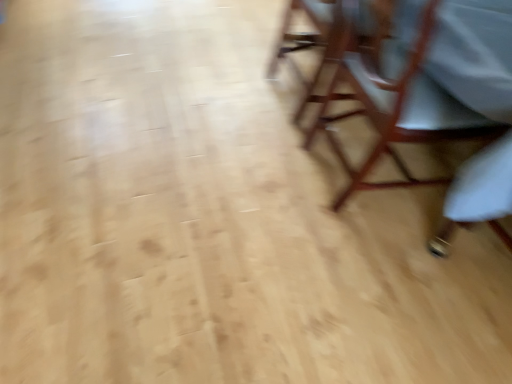
At what (x,y) coordinates should I click in order to perform the action: click on wooden chair at upper right, which is the second chair from front to back. Please return your answer as a coordinate pair (x, y). This screenshot has height=384, width=512. Looking at the image, I should click on (311, 42).

Measure the distance between point (335, 26) and camera.

The distance of point (335, 26) from camera is 6.18 feet.

What is the approximate height of wooden chair at upper right, the 1th chair positioned from the back?

24.34 inches.

The height and width of the screenshot is (384, 512). Describe the element at coordinates (311, 42) in the screenshot. I see `wooden chair at upper right, the 1th chair positioned from the back` at that location.

What do you see at coordinates (393, 100) in the screenshot? I see `wooden chair at right, the 2th chair positioned from the back` at bounding box center [393, 100].

Where is `wooden chair at right, arranged as the 1th chair when viewed from the front`? wooden chair at right, arranged as the 1th chair when viewed from the front is located at coordinates (393, 100).

Identify the location of wooden chair at upper right, which is the second chair from front to back. The width and height of the screenshot is (512, 384). (311, 42).

Which object is positioned more to the right, wooden chair at upper right, the 1th chair positioned from the back, or wooden chair at right, arranged as the 1th chair when viewed from the front?

wooden chair at right, arranged as the 1th chair when viewed from the front, is more to the right.

In the image, is wooden chair at upper right, the 1th chair positioned from the back, positioned in front of or behind wooden chair at right, arranged as the 1th chair when viewed from the front?

Clearly, wooden chair at upper right, the 1th chair positioned from the back, is behind wooden chair at right, arranged as the 1th chair when viewed from the front.

Which is closer to the camera, [365,41] or [378,83]?

Point [365,41] is farther from the camera than point [378,83].

From the image's perspective, between wooden chair at upper right, the 1th chair positioned from the back, and wooden chair at right, the 2th chair positioned from the back, who is located below?

wooden chair at right, the 2th chair positioned from the back, appears lower in the image.

From a real-world perspective, which object stands above the other?

wooden chair at right, the 2th chair positioned from the back.

In the scene shown: Can you confirm if wooden chair at upper right, the 1th chair positioned from the back, is thinner than wooden chair at right, the 2th chair positioned from the back?

Yes.

Does wooden chair at upper right, the 1th chair positioned from the back, have a greater height compared to wooden chair at right, the 2th chair positioned from the back?

→ No, wooden chair at upper right, the 1th chair positioned from the back, is not taller than wooden chair at right, the 2th chair positioned from the back.

Between wooden chair at upper right, the 1th chair positioned from the back, and wooden chair at right, the 2th chair positioned from the back, which one has smaller size?

Smaller between the two is wooden chair at upper right, the 1th chair positioned from the back.

Is wooden chair at upper right, the 1th chair positioned from the back, located outside wooden chair at right, the 2th chair positioned from the back?

Yes, wooden chair at upper right, the 1th chair positioned from the back, is not within wooden chair at right, the 2th chair positioned from the back.

Could you tell me if wooden chair at upper right, the 1th chair positioned from the back, is turned towards wooden chair at right, arranged as the 1th chair when viewed from the front?

No, wooden chair at upper right, the 1th chair positioned from the back, is not oriented towards wooden chair at right, arranged as the 1th chair when viewed from the front.

How distant is wooden chair at upper right, which is the second chair from front to back, from wooden chair at right, the 2th chair positioned from the back?

wooden chair at upper right, which is the second chair from front to back, is 29.09 centimeters from wooden chair at right, the 2th chair positioned from the back.

Locate an element on the screen. Image resolution: width=512 pixels, height=384 pixels. chair above the wooden chair at upper right, the 1th chair positioned from the back (from a real-world perspective) is located at coordinates (393, 100).

In the image, is wooden chair at right, arranged as the 1th chair when viewed from the front, on the left side or the right side of wooden chair at upper right, the 1th chair positioned from the back?

wooden chair at right, arranged as the 1th chair when viewed from the front, is positioned on wooden chair at upper right, the 1th chair positioned from the back,'s right side.

In the image, is wooden chair at right, the 2th chair positioned from the back, positioned in front of or behind wooden chair at upper right, the 1th chair positioned from the back?

wooden chair at right, the 2th chair positioned from the back, is in front of wooden chair at upper right, the 1th chair positioned from the back.

Considering the positions of point (320, 110) and point (371, 28), is point (320, 110) closer or farther from the camera than point (371, 28)?

Point (320, 110) is positioned farther from the camera compared to point (371, 28).

From the image's perspective, which one is positioned higher, wooden chair at right, the 2th chair positioned from the back, or wooden chair at upper right, which is the second chair from front to back?

wooden chair at upper right, which is the second chair from front to back, from the image's perspective.

From a real-world perspective, which is physically below, wooden chair at right, arranged as the 1th chair when viewed from the front, or wooden chair at upper right, which is the second chair from front to back?

wooden chair at upper right, which is the second chair from front to back.

Is wooden chair at right, arranged as the 1th chair when viewed from the front, wider or thinner than wooden chair at upper right, which is the second chair from front to back?

In the image, wooden chair at right, arranged as the 1th chair when viewed from the front, appears to be wider than wooden chair at upper right, which is the second chair from front to back.

Which of these two, wooden chair at right, arranged as the 1th chair when viewed from the front, or wooden chair at upper right, which is the second chair from front to back, stands shorter?

Standing shorter between the two is wooden chair at upper right, which is the second chair from front to back.

Considering the relative sizes of wooden chair at right, the 2th chair positioned from the back, and wooden chair at upper right, which is the second chair from front to back, in the image provided, is wooden chair at right, the 2th chair positioned from the back, bigger than wooden chair at upper right, which is the second chair from front to back,?

Yes, wooden chair at right, the 2th chair positioned from the back, is bigger than wooden chair at upper right, which is the second chair from front to back.

In the scene shown: Choose the correct answer: Is wooden chair at right, arranged as the 1th chair when viewed from the front, inside wooden chair at upper right, the 1th chair positioned from the back, or outside it?

wooden chair at right, arranged as the 1th chair when viewed from the front, is located beyond the bounds of wooden chair at upper right, the 1th chair positioned from the back.

Is there a large distance between wooden chair at right, arranged as the 1th chair when viewed from the front, and wooden chair at upper right, the 1th chair positioned from the back?

No, wooden chair at right, arranged as the 1th chair when viewed from the front, is not far from wooden chair at upper right, the 1th chair positioned from the back.

Is wooden chair at right, the 2th chair positioned from the back, positioned with its back to wooden chair at upper right, the 1th chair positioned from the back?

That's not correct — wooden chair at right, the 2th chair positioned from the back, is not looking away from wooden chair at upper right, the 1th chair positioned from the back.

Locate an element on the screen. chair above the wooden chair at right, the 2th chair positioned from the back (from the image's perspective) is located at coordinates (311, 42).

What are the coordinates of `chair below the wooden chair at upper right, the 1th chair positioned from the back (from the image's perspective)` in the screenshot? It's located at (393, 100).

Image resolution: width=512 pixels, height=384 pixels. I want to click on chair located in front of the wooden chair at upper right, the 1th chair positioned from the back, so click(393, 100).